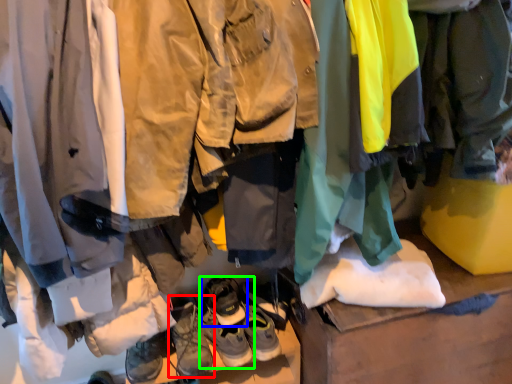
Question: Estimate the real-world distances between objects in this image. Which object is farther from footwear (highlighted by a red box), footwear (highlighted by a blue box) or footwear (highlighted by a green box)?

Choices:
 (A) footwear
 (B) footwear

Answer: (A)